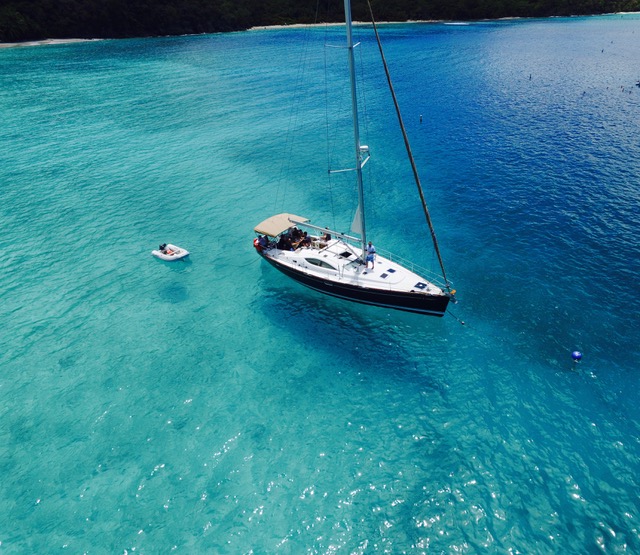
Identify the location of rod. (368, 160), (371, 151), (338, 171).